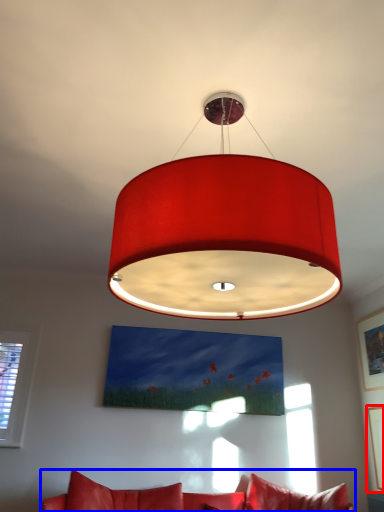
Question: Which of the following is the closest to the observer, picture frame (highlighted by a red box) or studio couch (highlighted by a blue box)?

Choices:
 (A) picture frame
 (B) studio couch

Answer: (B)